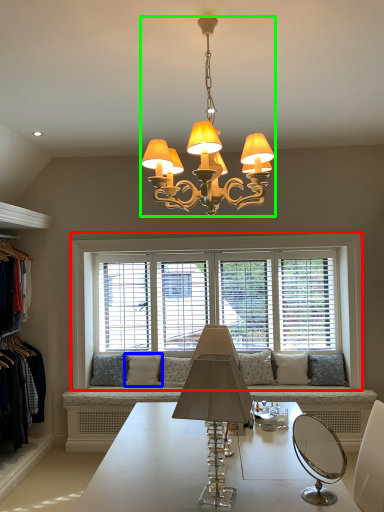
Question: Which object is the closest to the window (highlighted by a red box)? Choose among these: pillow (highlighted by a blue box) or lamp (highlighted by a green box).

Choices:
 (A) pillow
 (B) lamp

Answer: (A)